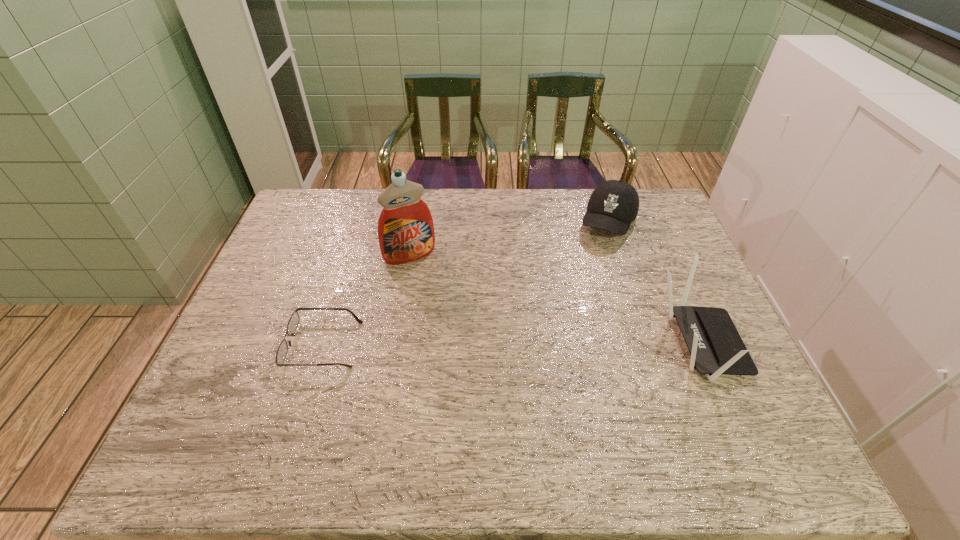
Locate an element on the screen. Image resolution: width=960 pixels, height=540 pixels. object that is at the near right corner is located at coordinates (716, 347).

This screenshot has width=960, height=540. In the image, there is a desktop. What are the coordinates of `vacant region at the far edge` in the screenshot? It's located at (466, 196).

This screenshot has width=960, height=540. In the image, there is a desktop. Find the location of `free space at the near edge`. free space at the near edge is located at coordinates (456, 391).

The image size is (960, 540). Find the location of `vacant region at the right edge of the desktop`. vacant region at the right edge of the desktop is located at coordinates (661, 314).

This screenshot has height=540, width=960. Find the location of `vacant space at the far left corner of the desktop`. vacant space at the far left corner of the desktop is located at coordinates (324, 210).

I want to click on vacant area at the near left corner of the desktop, so click(x=219, y=416).

Where is `vacant space at the far right corner of the desktop`? vacant space at the far right corner of the desktop is located at coordinates (640, 201).

This screenshot has width=960, height=540. Identify the location of free region at the near right corner. (694, 402).

The height and width of the screenshot is (540, 960). I want to click on free space between the router and the leftmost object, so click(512, 344).

Image resolution: width=960 pixels, height=540 pixels. Identify the location of vacant point located between the tallest object and the router. click(555, 300).